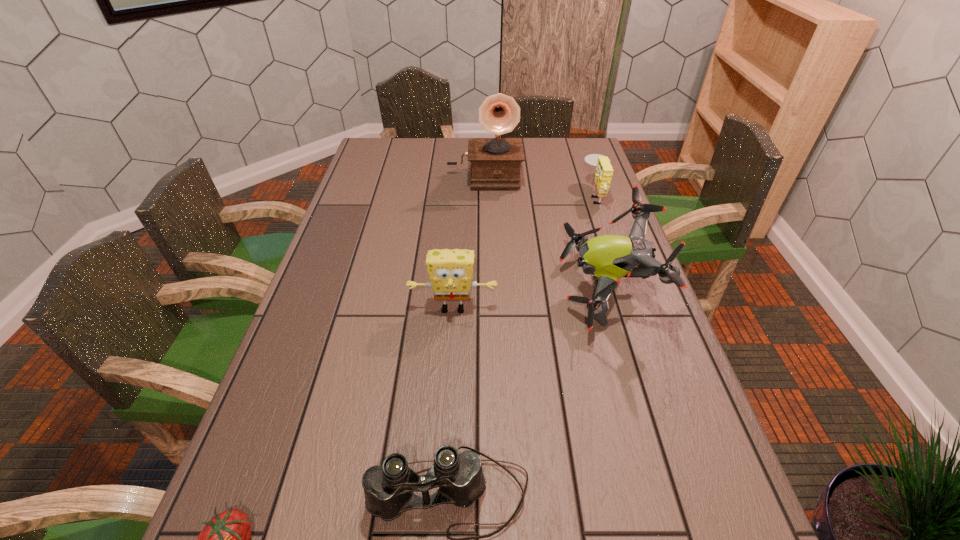
The width and height of the screenshot is (960, 540). Identify the location of vacant region at the far left corner of the desktop. (393, 141).

Identify the location of blank area at the far right corner. This screenshot has width=960, height=540. coord(568,163).

You are a GUI agent. You are given a task and a screenshot of the screen. Output one action in this format:
    pyautogui.click(x=<x>, y=<y>)
    Task: Click on the unoccupied position between the taller sponge and the farther sponge
    
    Given the screenshot: What is the action you would take?
    pyautogui.click(x=524, y=252)

Find the location of a particular element. vacant space that is in between the left sponge and the farther sponge is located at coordinates (524, 252).

At what (x,y) coordinates should I click in order to perform the action: click on vacant region between the shorter sponge and the fourth shortest object. Please return your answer as a coordinate pair (x, y). The height and width of the screenshot is (540, 960). Looking at the image, I should click on (524, 252).

This screenshot has width=960, height=540. Identify the location of empty space that is in between the second tallest object and the fourth shortest object. (530, 299).

Locate which object ranks third in proximity to the leftmost object. Please provide its 2D coordinates. Your answer should be formatted as a tuple, i.e. [(x, y)], where the tuple contains the x and y coordinates of a point satisfying the conditions above.

[(609, 258)]

Where is `object that is the fourth closest to the tomato`? object that is the fourth closest to the tomato is located at coordinates (495, 162).

Locate an element on the screen. vacant region that satisfies the following two spatial constraints: 1. on the front-facing side of the drone; 2. on the face of the nearer sponge is located at coordinates (612, 309).